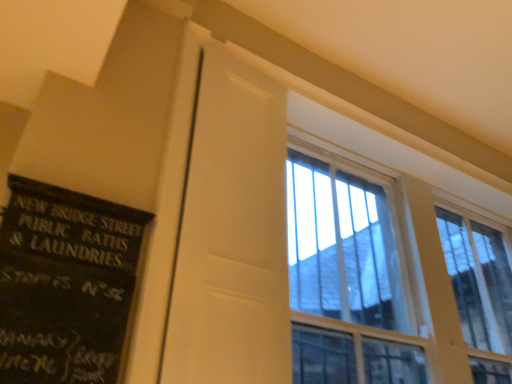
Question: From the image's perspective, is white matte door at center beneath clear glass window at upper right?

Choices:
 (A) no
 (B) yes

Answer: (A)

Question: Does white matte door at center have a lesser width compared to clear glass window at upper right?

Choices:
 (A) no
 (B) yes

Answer: (B)

Question: Can you confirm if white matte door at center is positioned to the left of clear glass window at upper right?

Choices:
 (A) yes
 (B) no

Answer: (A)

Question: Is clear glass window at upper right located within white matte door at center?

Choices:
 (A) yes
 (B) no

Answer: (B)

Question: Is white matte door at center closer to camera compared to clear glass window at upper right?

Choices:
 (A) yes
 (B) no

Answer: (A)

Question: Is white matte door at center facing towards clear glass window at upper right?

Choices:
 (A) yes
 (B) no

Answer: (B)

Question: Would you say white matte door at center is part of black painted wood signboard at left's contents?

Choices:
 (A) yes
 (B) no

Answer: (B)

Question: Is black painted wood signboard at left thinner than white matte door at center?

Choices:
 (A) no
 (B) yes

Answer: (A)

Question: Is black painted wood signboard at left directly adjacent to white matte door at center?

Choices:
 (A) yes
 (B) no

Answer: (B)

Question: Is black painted wood signboard at left completely or partially outside of white matte door at center?

Choices:
 (A) yes
 (B) no

Answer: (A)

Question: Considering the relative sizes of black painted wood signboard at left and white matte door at center in the image provided, is black painted wood signboard at left wider than white matte door at center?

Choices:
 (A) yes
 (B) no

Answer: (A)

Question: Is black painted wood signboard at left looking in the opposite direction of white matte door at center?

Choices:
 (A) no
 (B) yes

Answer: (A)

Question: From a real-world perspective, is white matte door at center under black painted wood signboard at left?

Choices:
 (A) no
 (B) yes

Answer: (A)